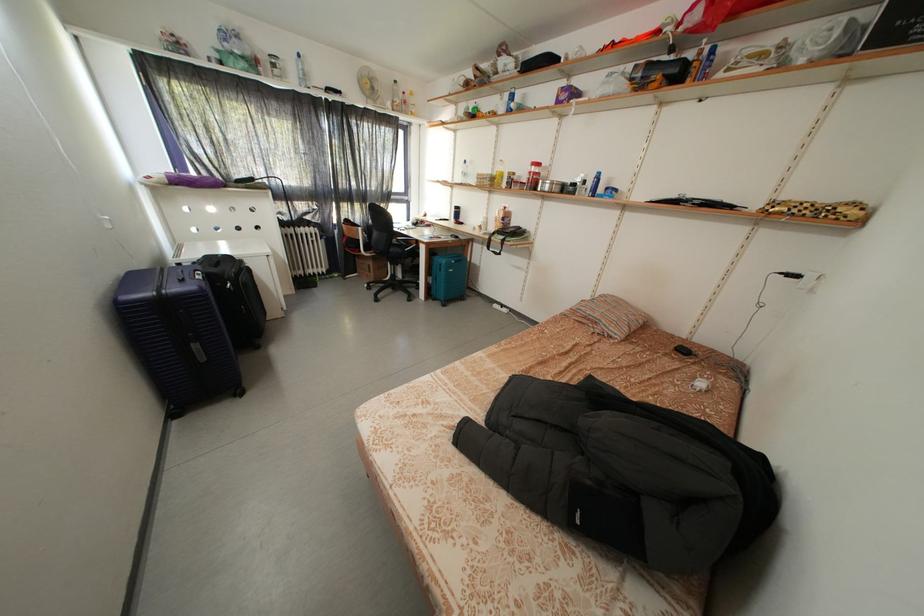
The location [300,71] corresponds to which object?

This point indicates the blue spray bottle.